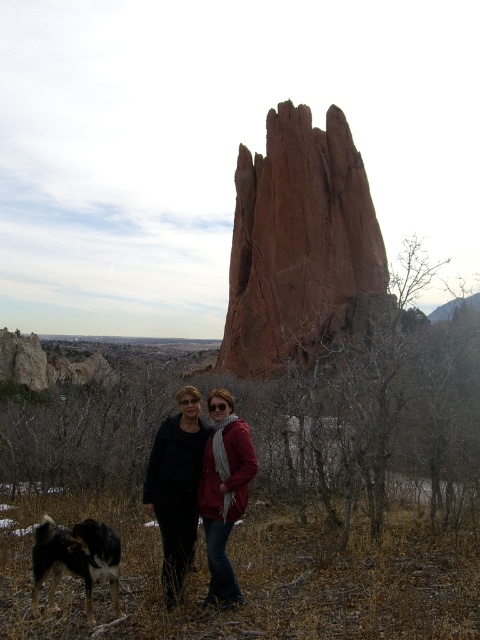
Question: Observing the image, what is the correct spatial positioning of matte black jacket at center in reference to black and white fur at lower left?

Choices:
 (A) above
 (B) below

Answer: (A)

Question: Which of the following is the farthest from the observer?

Choices:
 (A) black and white fur at lower left
 (B) matte red jacket at center
 (C) matte black jacket at center

Answer: (B)

Question: Which object is the farthest from the matte red jacket at center?

Choices:
 (A) matte black jacket at center
 (B) black and white fur at lower left

Answer: (B)

Question: Considering the real-world distances, which object is farthest from the matte red jacket at center?

Choices:
 (A) matte black jacket at center
 (B) black and white fur at lower left

Answer: (B)

Question: Can you confirm if matte black jacket at center is thinner than black and white fur at lower left?

Choices:
 (A) yes
 (B) no

Answer: (A)

Question: Is reddish-brown rock at center below matte black jacket at center?

Choices:
 (A) yes
 (B) no

Answer: (B)